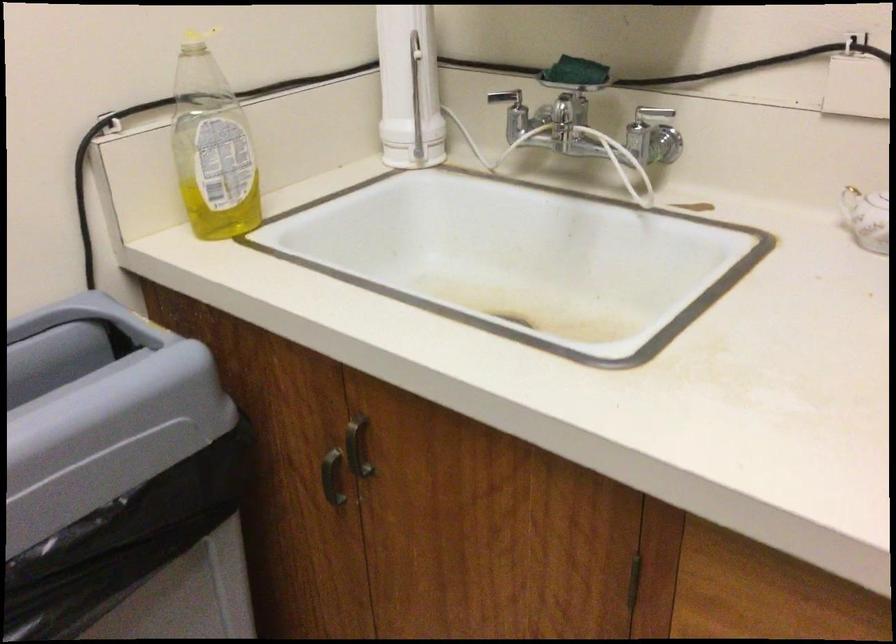
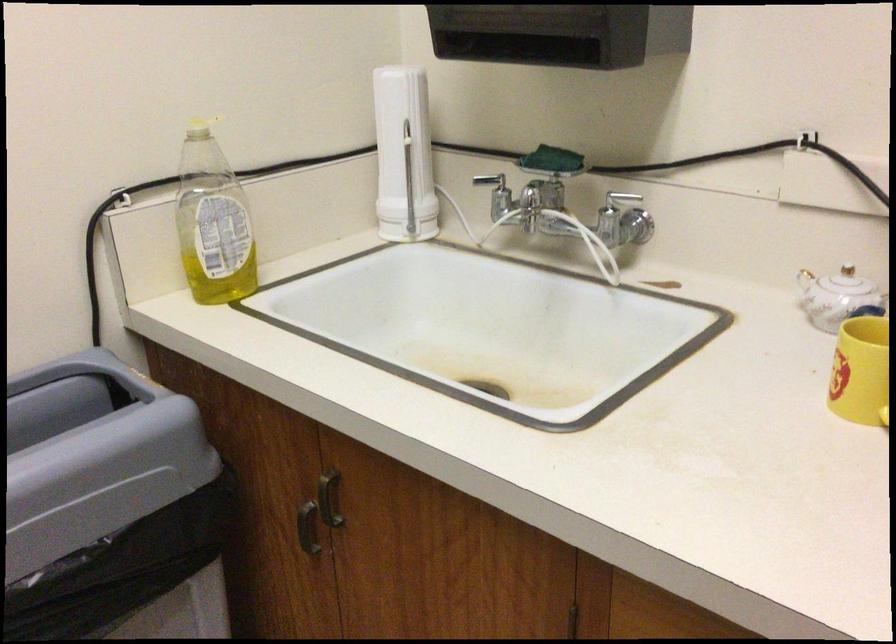
In the second image, find the point that corresponds to point 513,115 in the first image.

(496, 194)